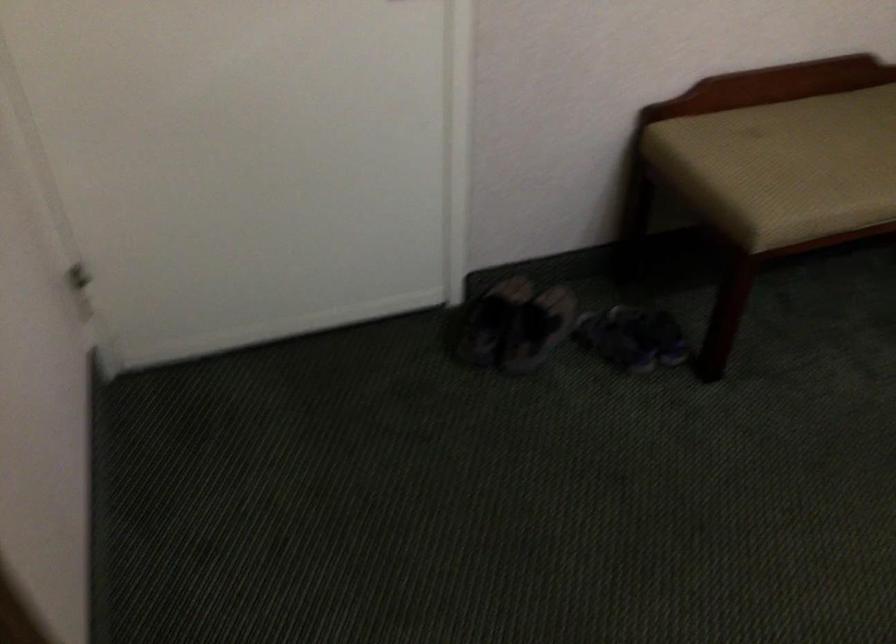
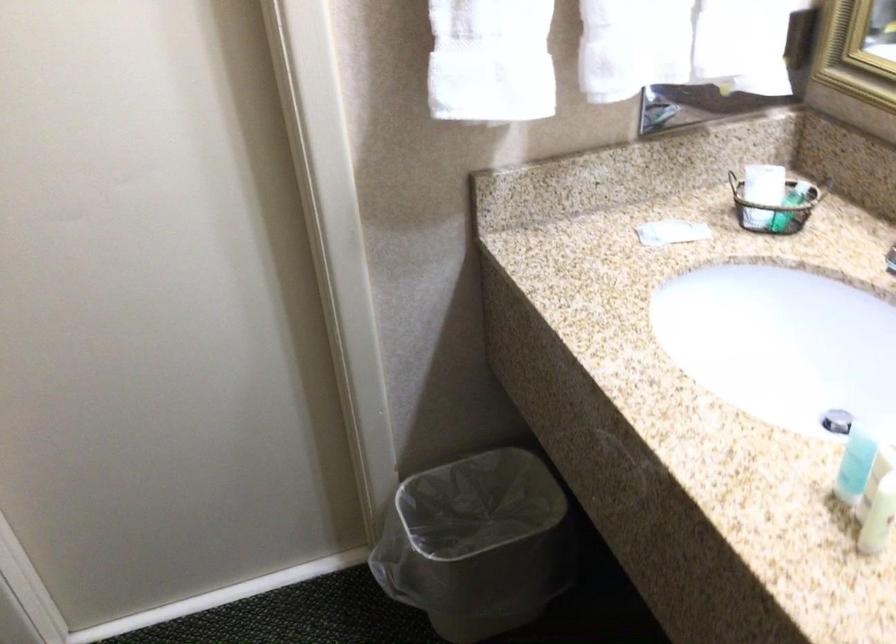
From the picture: Based on the continuous images, in which direction is the camera rotating?

The rotation direction of the camera is right-down.